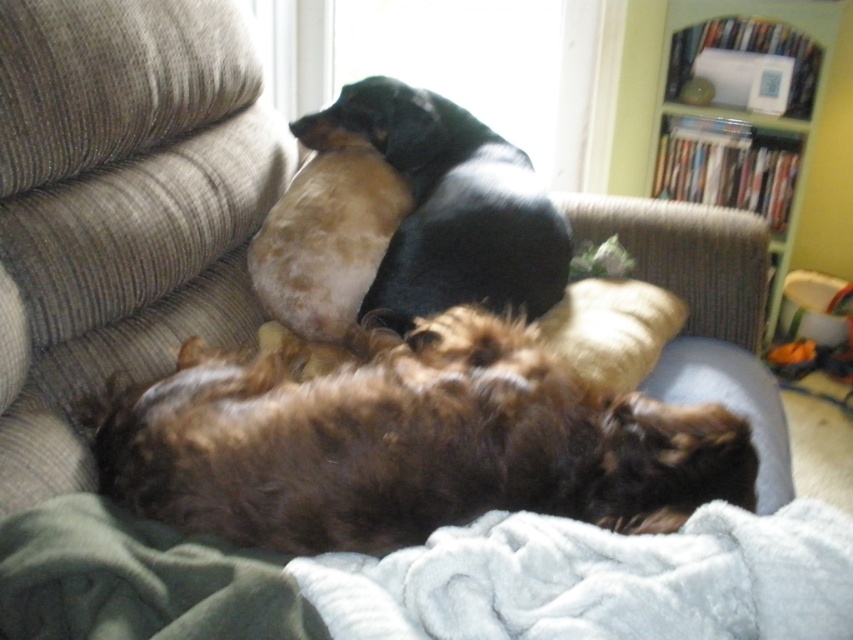
Is the position of brown shaggy dog at center less distant than that of black smooth dog at upper center?

Yes, brown shaggy dog at center is in front of black smooth dog at upper center.

Who is taller, brown shaggy dog at center or black smooth dog at upper center?

With more height is black smooth dog at upper center.

Between point (517, 337) and point (492, 211), which one is positioned in front?

Point (517, 337)

The image size is (853, 640). What are the coordinates of `brown shaggy dog at center` in the screenshot? It's located at (407, 442).

What do you see at coordinates (407, 442) in the screenshot? I see `brown shaggy dog at center` at bounding box center [407, 442].

Who is more distant from viewer, [141,438] or [654,296]?

Positioned behind is point [654,296].

I want to click on brown shaggy dog at center, so click(407, 442).

Between black smooth dog at upper center and soft yellow pillow at center, which one has more height?

black smooth dog at upper center is taller.

Does point (479, 132) come farther from viewer compared to point (682, 324)?

Yes, point (479, 132) is farther from viewer.

In order to click on black smooth dog at upper center in this screenshot , I will do 450,205.